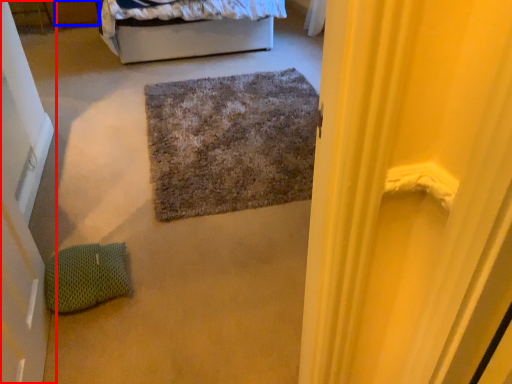
Question: Which object appears closest to the camera in this image, door (highlighted by a red box) or drawer (highlighted by a blue box)?

Choices:
 (A) door
 (B) drawer

Answer: (A)